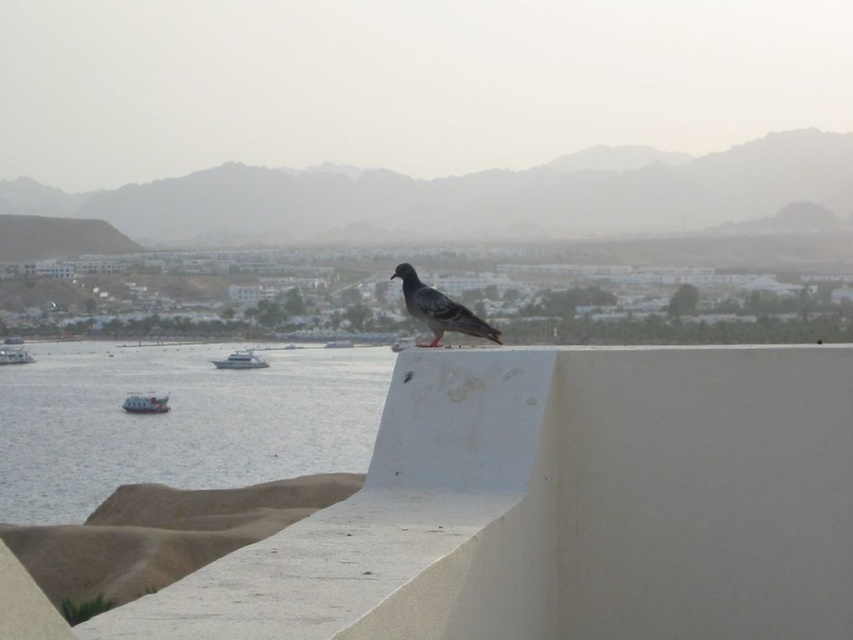
You are a birdwatcher observing the scene. You notice the gray matte pigeon at center and the white glossy boat at center. Which object is positioned higher in the image?

The gray matte pigeon at center is located above the white glossy boat at center, so it is positioned higher in the image.

You are standing on the concrete structure in the scene and want to place a 30 inch long fishing rod between the blue water at lower left and the metallic gray boat at lower left. Can you fit it there without overlapping either?

The blue water at lower left is 29.97 inches from metallic gray boat at lower left. Since the fishing rod is 30 inches long, it would be slightly too long to fit between them without overlapping either object.